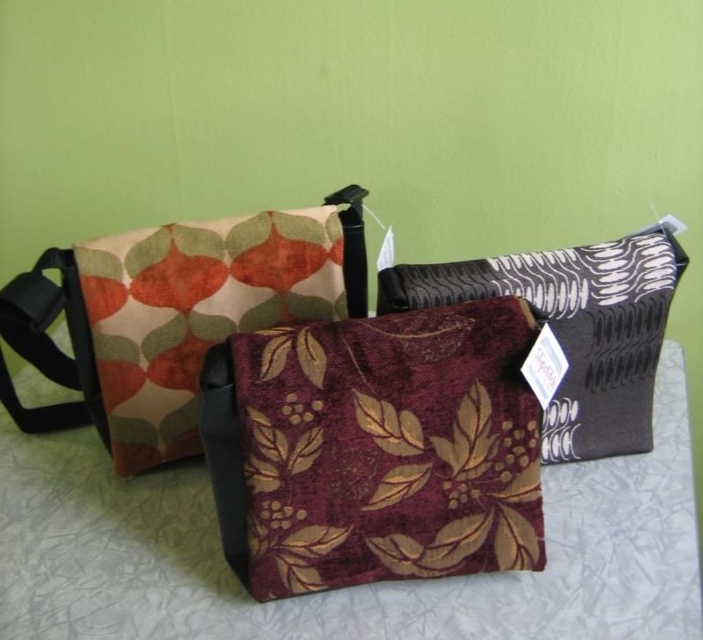
You are organizing a small gift set and need to place the burgundy velvety pouch at center and the velvety floral pouch at center in a specific order. According to the image, which pouch is positioned to the right of the other?

The burgundy velvety pouch at center is positioned to the right of the velvety floral pouch at center.

Looking at this image, you are organizing a small gift set and need to place both the burgundy velvet pouch at center and the velvety floral pouch at center into a storage box. The box has a maximum width of 30 centimeters. Can both pouches fit side by side in the box without overlapping?

The burgundy velvet pouch at center is 28.56 centimeters away from the velvety floral pouch at center, so they can fit side by side in the box since the distance between them is less than the box width of 30 centimeters.

You are organizing a small gift box that measures 15 cm in width. You need to choose between the burgundy velvety pouch at center and the burgundy velvet pouch at center to place it inside. Which pouch can accommodate the gift box based on their widths?

The burgundy velvet pouch at center has a greater width than the burgundy velvety pouch at center. Since the gift box is 15 cm wide, the burgundy velvet pouch at center can accommodate it, while the other might be too narrow.